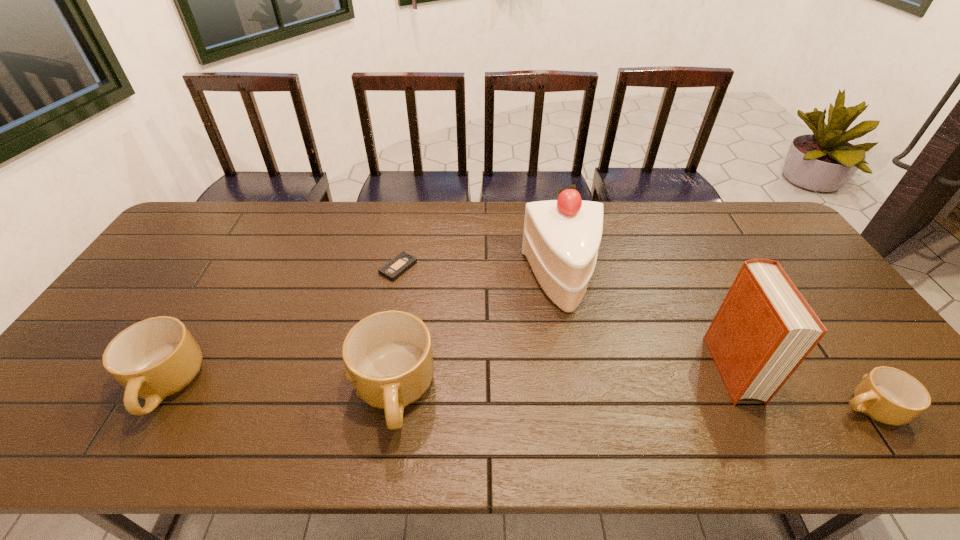
I want to click on vacant region located 0.180m on the side with the handle of the rightmost mug, so click(758, 408).

You are a GUI agent. You are given a task and a screenshot of the screen. Output one action in this format:
    pyautogui.click(x=<x>, y=<y>)
    Task: Click on the vacant area situated on the left of the third object from right to left
    
    Given the screenshot: What is the action you would take?
    tap(485, 281)

This screenshot has height=540, width=960. Identify the location of vacant region located on the left of the shortest object. (251, 267).

Where is `hardback book that is at the near edge`? The width and height of the screenshot is (960, 540). hardback book that is at the near edge is located at coordinates click(x=764, y=329).

Identify the location of object present at the right edge. (888, 395).

Identify the location of object at the near right corner. pos(888,395).

Locate an element on the screen. vacant space at the far edge is located at coordinates (725, 221).

Image resolution: width=960 pixels, height=540 pixels. I want to click on free spot at the near edge of the desktop, so tap(783, 400).

Locate an element on the screen. blank space at the left edge is located at coordinates (203, 266).

In the image, there is a desktop. Find the location of `vacant space at the right edge`. vacant space at the right edge is located at coordinates (829, 344).